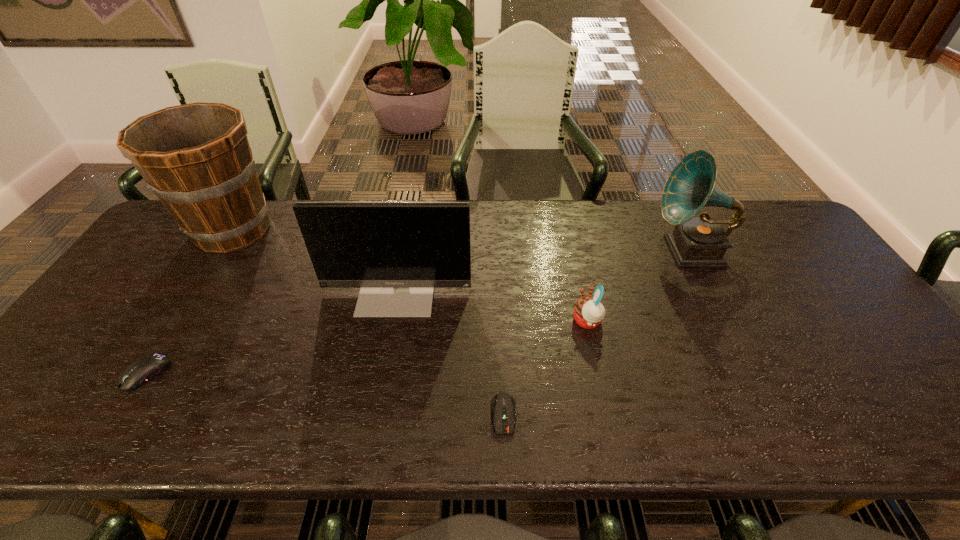
At what (x,y) coordinates should I click in order to perform the action: click on free point located from the horn of the phonograph_record. Please return your answer as a coordinate pair (x, y). The image size is (960, 540). Looking at the image, I should click on (604, 251).

Where is `vacant space located from the horn of the phonograph_record`? The image size is (960, 540). vacant space located from the horn of the phonograph_record is located at coordinates (551, 251).

The height and width of the screenshot is (540, 960). Find the location of `vacant area situated 0.220m from the horn of the phonograph_record`. vacant area situated 0.220m from the horn of the phonograph_record is located at coordinates (578, 251).

This screenshot has height=540, width=960. In order to click on vacant space located 0.160m on the screen of the computer monitor in this screenshot , I will do click(x=383, y=371).

Image resolution: width=960 pixels, height=540 pixels. Identify the location of free point located on the front-facing side of the muffin. (494, 321).

This screenshot has height=540, width=960. Find the location of `vacant region located on the front-facing side of the muffin`. vacant region located on the front-facing side of the muffin is located at coordinates (553, 321).

At what (x,y) coordinates should I click in order to perform the action: click on vacant space positioned on the front-facing side of the muffin. Please return your answer as a coordinate pair (x, y). Image resolution: width=960 pixels, height=540 pixels. Looking at the image, I should click on (494, 321).

In order to click on free space located on the right of the second nearest object in this screenshot , I will do `click(255, 373)`.

Where is `bucket positioned at the far edge`? This screenshot has height=540, width=960. bucket positioned at the far edge is located at coordinates (196, 158).

Where is `phonograph_record located at the far edge`? Image resolution: width=960 pixels, height=540 pixels. phonograph_record located at the far edge is located at coordinates (700, 241).